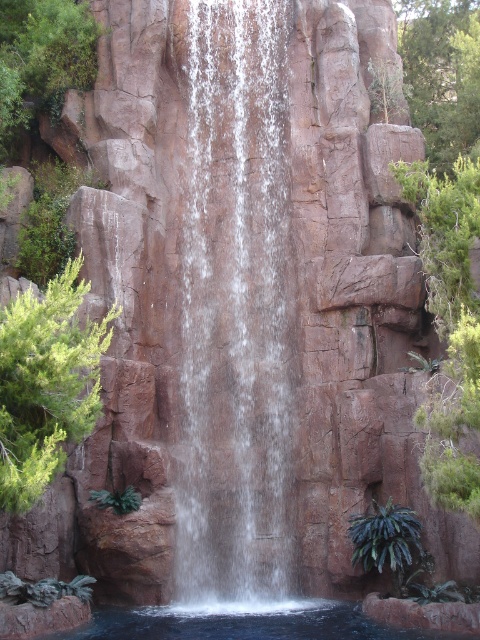
Based on the photo, can you confirm if green leafy tree at upper right is bigger than clear water at bottom?

Correct, green leafy tree at upper right is larger in size than clear water at bottom.

Is point (435, 54) more distant than point (345, 616)?

Yes, point (435, 54) is behind point (345, 616).

Locate an element on the screen. This screenshot has width=480, height=640. green leafy tree at upper right is located at coordinates coord(442,74).

Is point (359, 611) positioned after point (404, 525)?

That is True.

Is clear water at bottom behind green leafy plant at lower right?

No, clear water at bottom is in front of green leafy plant at lower right.

This screenshot has width=480, height=640. In order to click on clear water at bottom in this screenshot , I will do `click(244, 621)`.

Does green leafy tree at left appear under green leafy tree at upper right?

Yes.

Can you confirm if green leafy tree at left is positioned above green leafy tree at upper right?

Incorrect, green leafy tree at left is not positioned above green leafy tree at upper right.

Describe the element at coordinates (47, 384) in the screenshot. This screenshot has height=640, width=480. I see `green leafy tree at left` at that location.

Identify the location of green leafy tree at left. The image size is (480, 640). (47, 384).